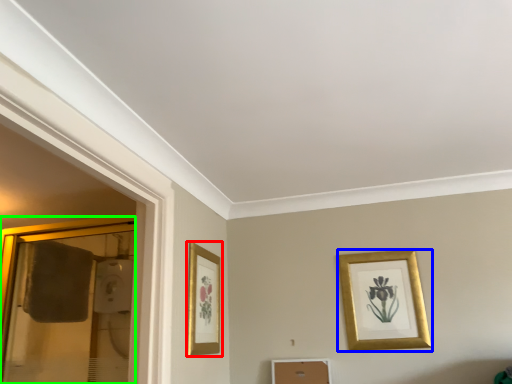
Question: Which is farther away from picture frame (highlighted by a red box)? picture frame (highlighted by a blue box) or glass door (highlighted by a green box)?

Choices:
 (A) picture frame
 (B) glass door

Answer: (B)